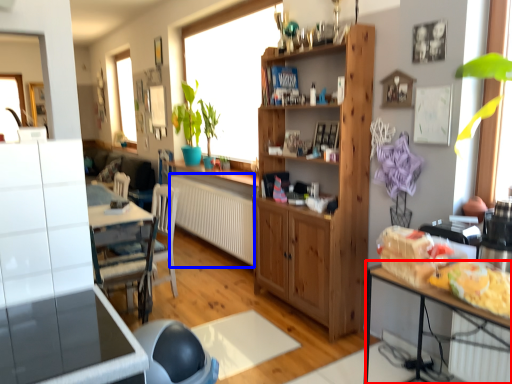
Question: Which object appears farthest to the camera in this image, table (highlighted by a red box) or radiator (highlighted by a blue box)?

Choices:
 (A) table
 (B) radiator

Answer: (B)